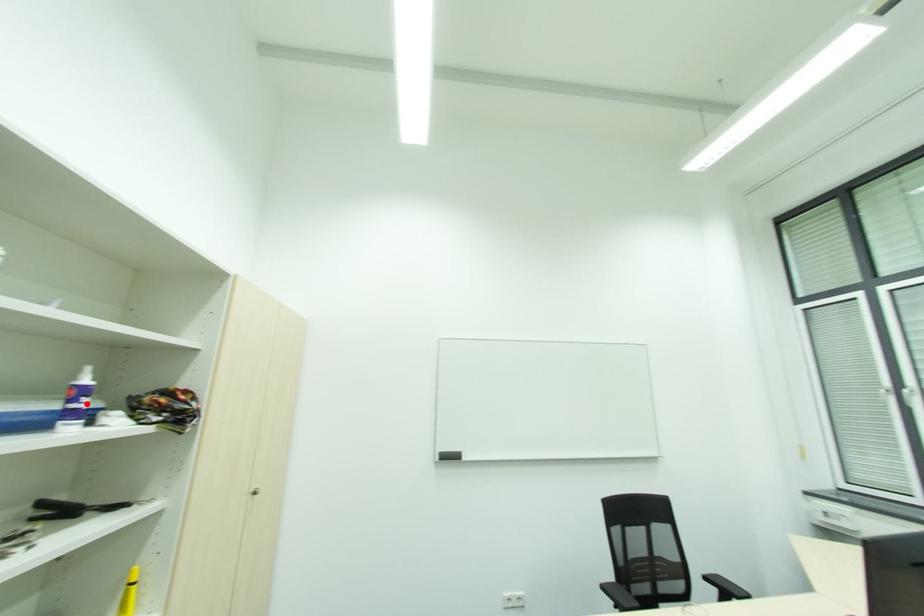
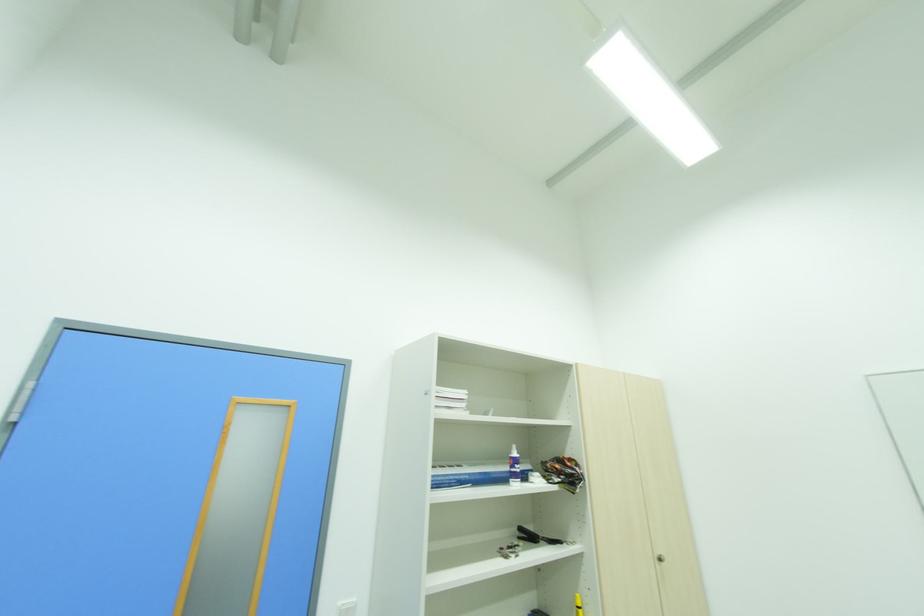
Find the pixel in the second image that matches the highlighted location in the first image.

(520, 469)